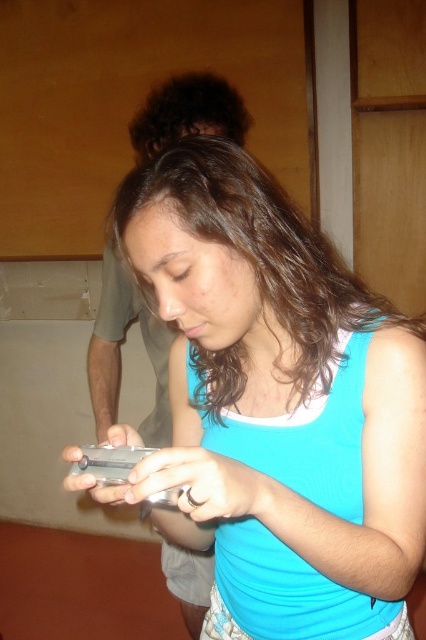
Question: Which point is closer to the camera?

Choices:
 (A) (206, 561)
 (B) (273, 481)

Answer: (B)

Question: Is matte silver phone at center thinner than gray matte shirt at upper left?

Choices:
 (A) no
 (B) yes

Answer: (A)

Question: Which point is farther to the camera?

Choices:
 (A) matte silver phone at center
 (B) gray matte shirt at upper left

Answer: (B)

Question: Is matte silver phone at center further to camera compared to gray matte shirt at upper left?

Choices:
 (A) no
 (B) yes

Answer: (A)

Question: Is matte silver phone at center positioned at the back of gray matte shirt at upper left?

Choices:
 (A) yes
 (B) no

Answer: (B)